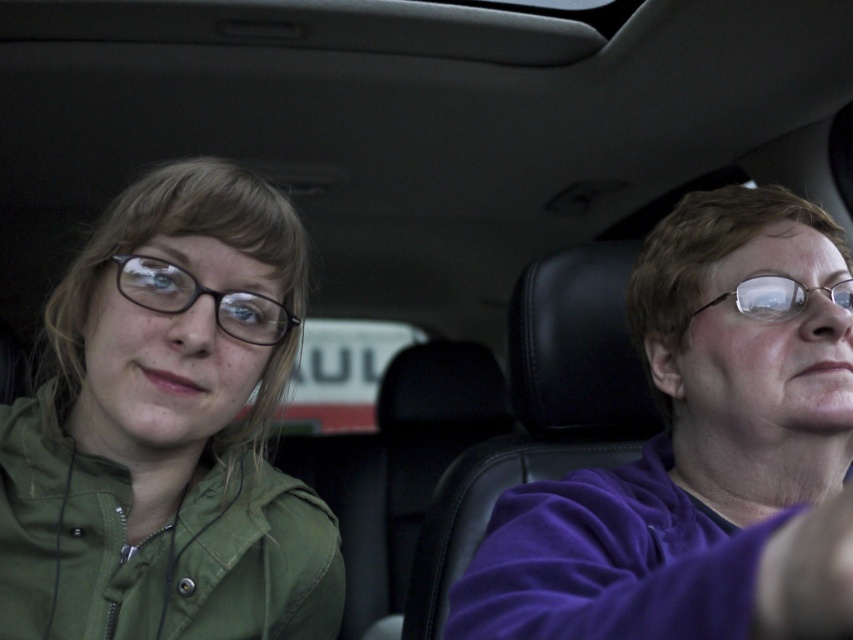
Who is lower down, purple fleece at right or clear plastic glasses at right?

purple fleece at right is below.

Who is more forward, (708, 518) or (781, 288)?

Point (781, 288) is in front.

Identify the location of purple fleece at right. This screenshot has height=640, width=853. (688, 442).

Is purple fleece at right shorter than black plastic glasses at left?

No.

Who is more forward, (556, 490) or (131, 275)?

Point (131, 275)

Identify the location of purple fleece at right. (688, 442).

Locate an element on the screen. This screenshot has height=640, width=853. matte green jacket at left is located at coordinates (167, 429).

Does matte green jacket at left have a lesser width compared to black plastic glasses at left?

Incorrect, matte green jacket at left's width is not less than black plastic glasses at left's.

What are the coordinates of `matte green jacket at left` in the screenshot? It's located at (167, 429).

Where is `matte green jacket at left`? matte green jacket at left is located at coordinates (167, 429).